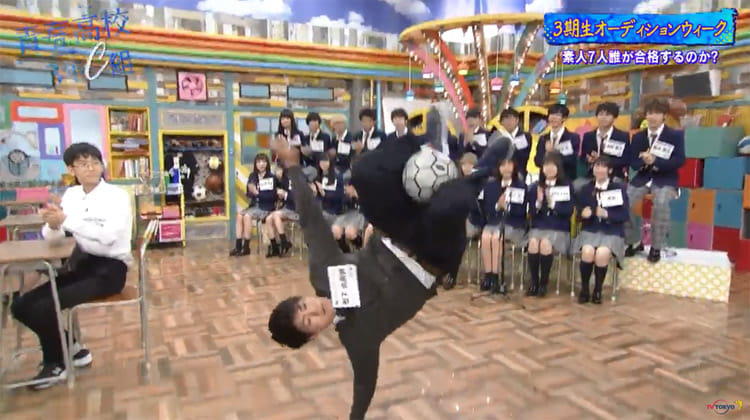
This screenshot has height=420, width=750. I want to click on table, so click(x=37, y=244), click(x=18, y=213).